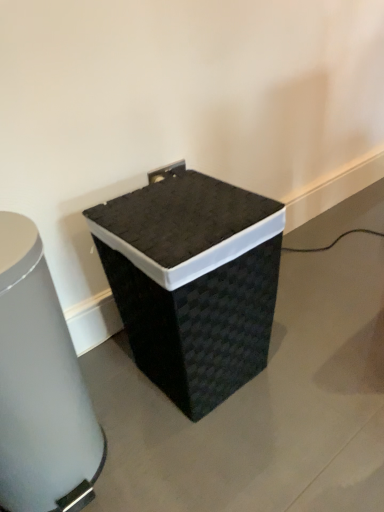
Question: In which direction should I rotate to look at black woven trash can at center, arranged as the first waste container when viewed from the left?

Choices:
 (A) right
 (B) left

Answer: (B)

Question: From a real-world perspective, is black woven waste container at center, acting as the first waste container starting from the right, on top of black woven trash can at center, marked as the 2th waste container in a right-to-left arrangement?

Choices:
 (A) yes
 (B) no

Answer: (B)

Question: From the image's perspective, is black woven waste container at center, the 2th waste container from the left, over black woven trash can at center, marked as the 2th waste container in a right-to-left arrangement?

Choices:
 (A) no
 (B) yes

Answer: (B)

Question: Would you say black woven waste container at center, acting as the first waste container starting from the right, is a long distance from black woven trash can at center, marked as the 2th waste container in a right-to-left arrangement?

Choices:
 (A) yes
 (B) no

Answer: (B)

Question: Is the position of black woven waste container at center, acting as the first waste container starting from the right, more distant than that of black woven trash can at center, marked as the 2th waste container in a right-to-left arrangement?

Choices:
 (A) yes
 (B) no

Answer: (A)

Question: Can you confirm if black woven waste container at center, acting as the first waste container starting from the right, is thinner than black woven trash can at center, arranged as the first waste container when viewed from the left?

Choices:
 (A) no
 (B) yes

Answer: (A)

Question: Considering the relative positions of black woven waste container at center, the 2th waste container from the left, and black woven trash can at center, arranged as the first waste container when viewed from the left, in the image provided, is black woven waste container at center, the 2th waste container from the left, to the left of black woven trash can at center, arranged as the first waste container when viewed from the left, from the viewer's perspective?

Choices:
 (A) no
 (B) yes

Answer: (A)

Question: From a real-world perspective, is black woven trash can at center, arranged as the first waste container when viewed from the left, physically above black woven waste container at center, acting as the first waste container starting from the right?

Choices:
 (A) no
 (B) yes

Answer: (B)

Question: From a real-world perspective, is black woven trash can at center, arranged as the first waste container when viewed from the left, under black woven waste container at center, acting as the first waste container starting from the right?

Choices:
 (A) yes
 (B) no

Answer: (B)

Question: From the image's perspective, does black woven trash can at center, marked as the 2th waste container in a right-to-left arrangement, appear higher than black woven waste container at center, acting as the first waste container starting from the right?

Choices:
 (A) yes
 (B) no

Answer: (B)

Question: Is black woven trash can at center, marked as the 2th waste container in a right-to-left arrangement, located outside black woven waste container at center, acting as the first waste container starting from the right?

Choices:
 (A) yes
 (B) no

Answer: (A)

Question: Can you confirm if black woven trash can at center, arranged as the first waste container when viewed from the left, is taller than black woven waste container at center, the 2th waste container from the left?

Choices:
 (A) yes
 (B) no

Answer: (A)

Question: Is black woven trash can at center, marked as the 2th waste container in a right-to-left arrangement, turned away from black woven waste container at center, acting as the first waste container starting from the right?

Choices:
 (A) no
 (B) yes

Answer: (A)

Question: Visually, is black woven trash can at center, marked as the 2th waste container in a right-to-left arrangement, positioned to the left or to the right of black woven waste container at center, acting as the first waste container starting from the right?

Choices:
 (A) left
 (B) right

Answer: (A)